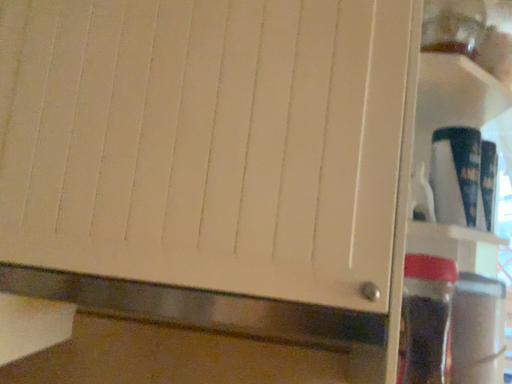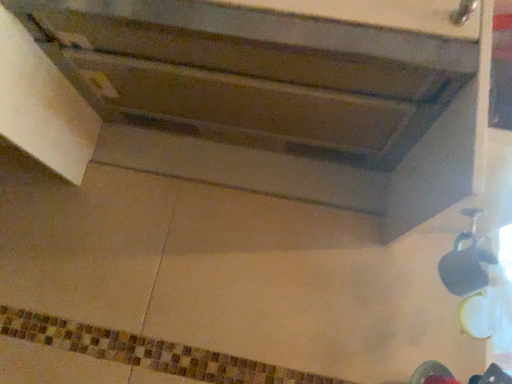
Question: How did the camera likely rotate when shooting the video?

Choices:
 (A) rotated upward
 (B) rotated downward

Answer: (A)